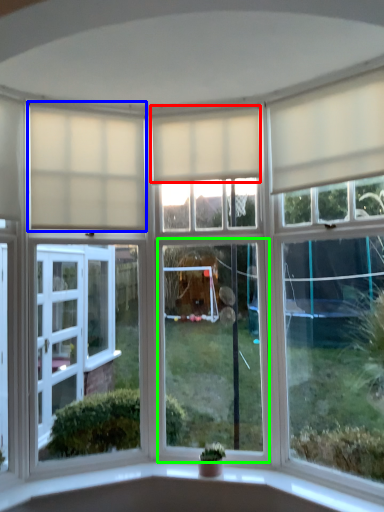
Question: Which object is positioned closest to curtain (highlighted by a red box)? Select from curtain (highlighted by a blue box) and window (highlighted by a green box).

Choices:
 (A) curtain
 (B) window

Answer: (A)